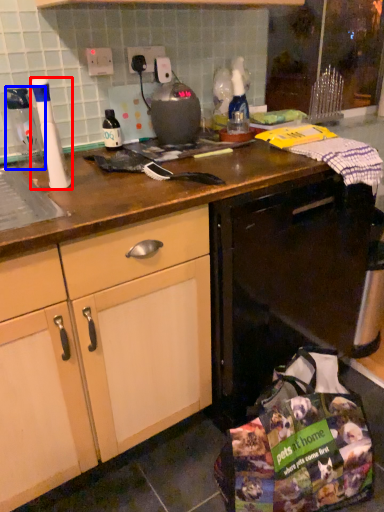
Question: Among these objects, which one is nearest to the camera, kitchen appliance (highlighted by a red box) or bottle (highlighted by a blue box)?

Choices:
 (A) kitchen appliance
 (B) bottle

Answer: (A)